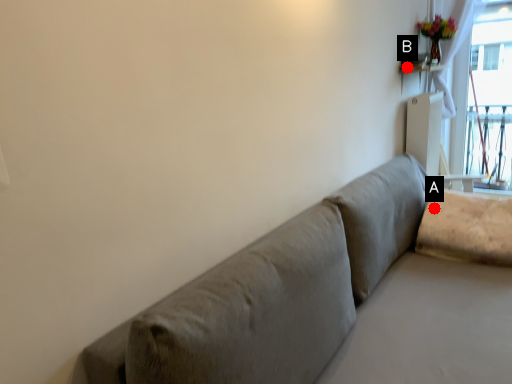
Question: Two points are circled on the image, labeled by A and B beside each circle. Which point is further to the camera?

Choices:
 (A) A is further
 (B) B is further

Answer: (B)